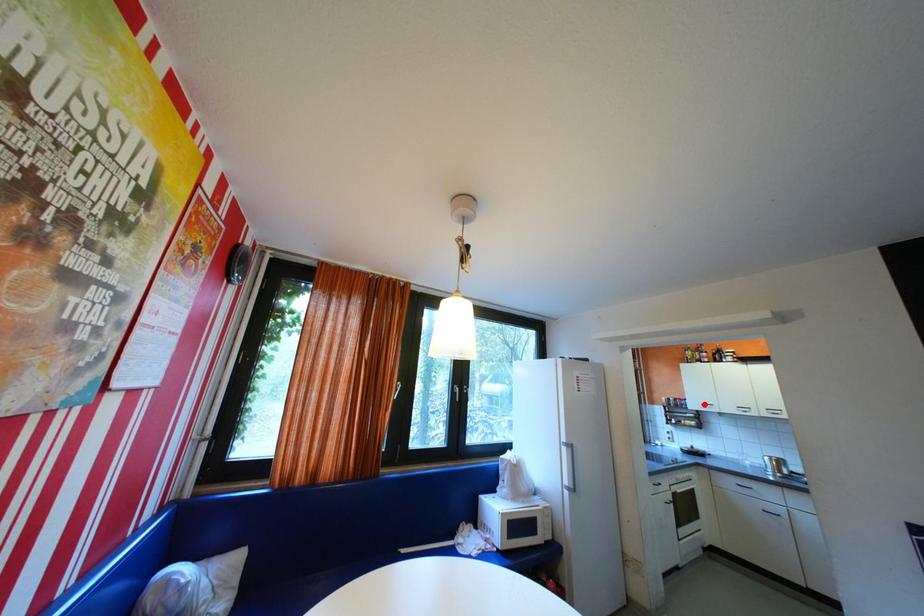
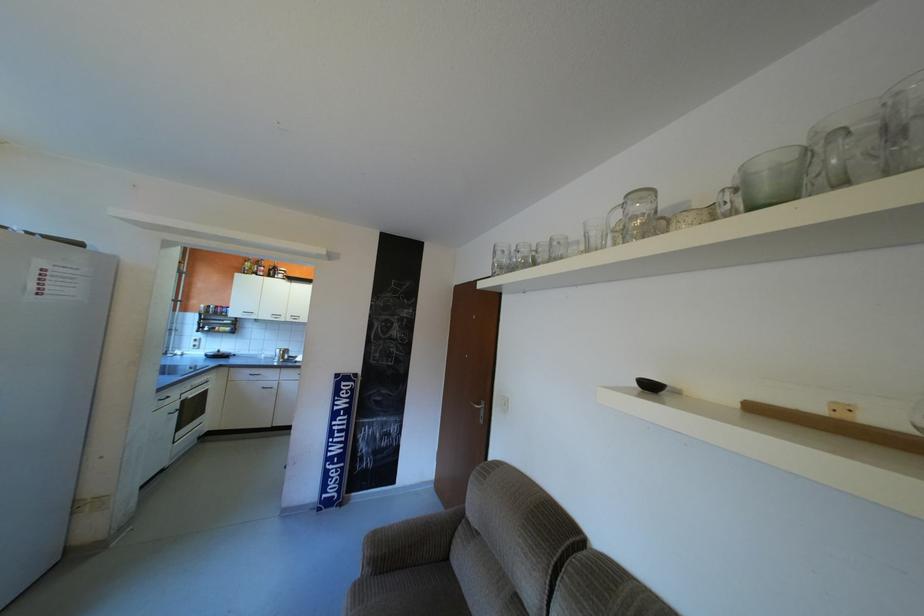
Find the pixel in the second image that matches the highlighted location in the first image.

(246, 312)